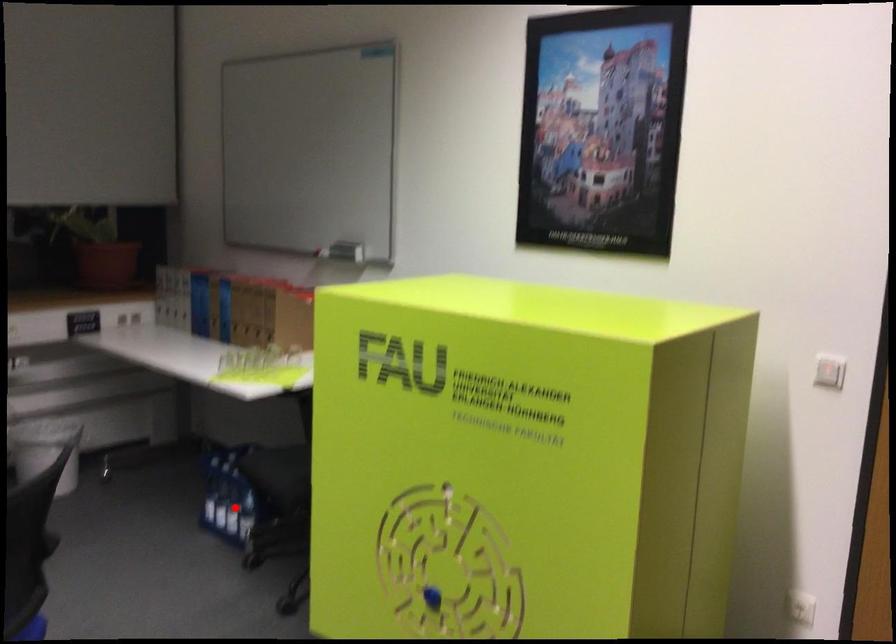
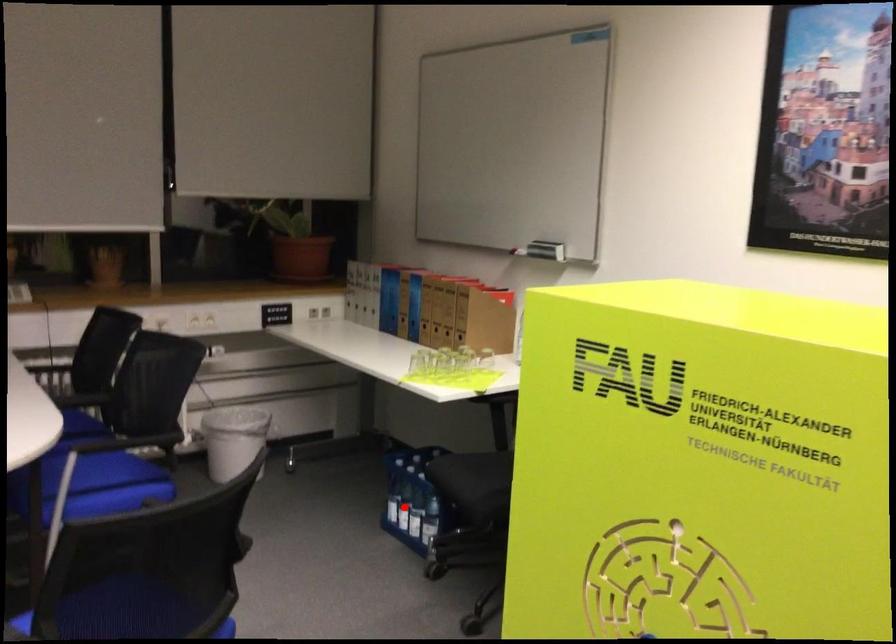
I am providing you with two images of the same scene from different viewpoints. A red point is marked on the first image and another point is marked on the second image. Are the points marked in image1 and image2 representing the same 3D position?

No